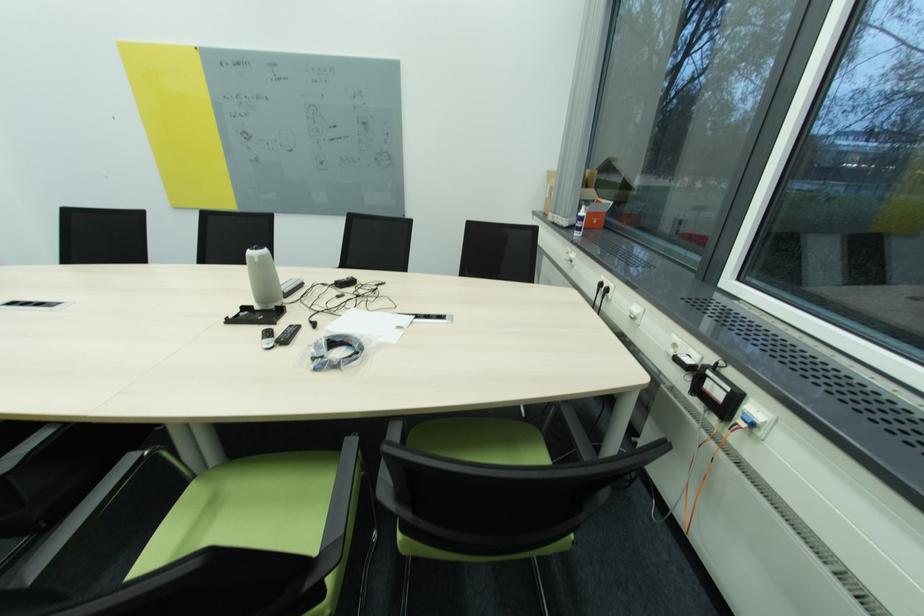
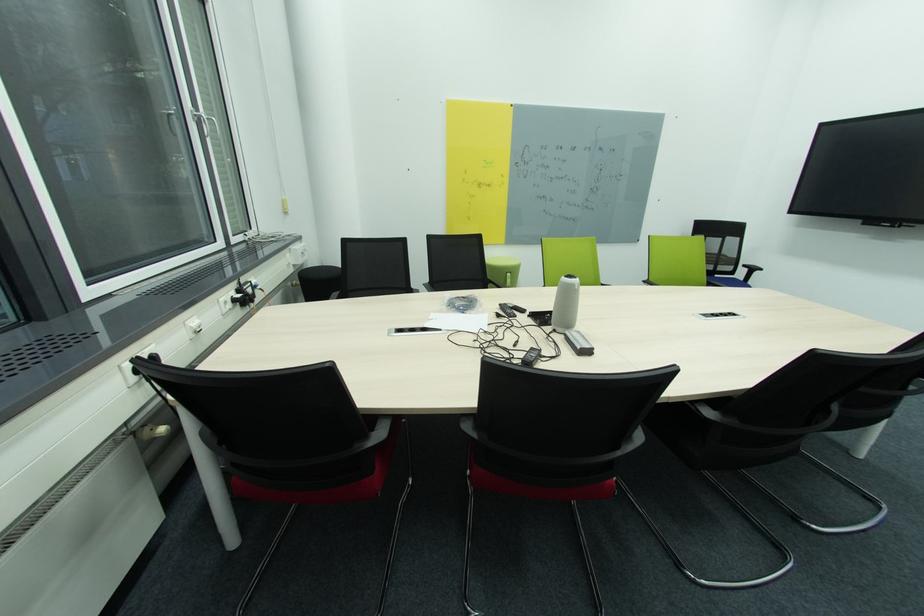
Where in the second image is the point corresponding to pixel 386 346 from the first image?

(444, 313)